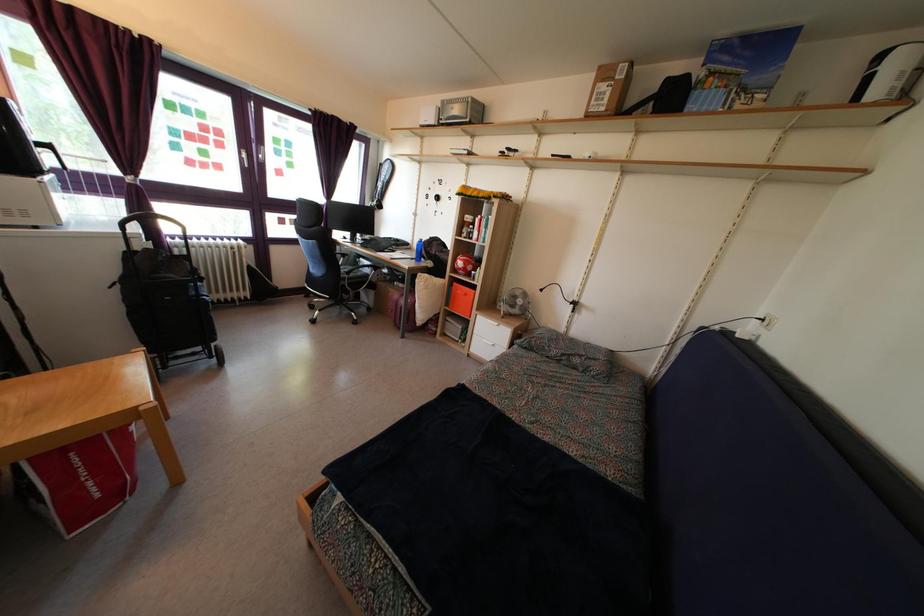
Find where to lift the red shopping bag. Please return your answer as a coordinate pair (x, y).

(79, 479)